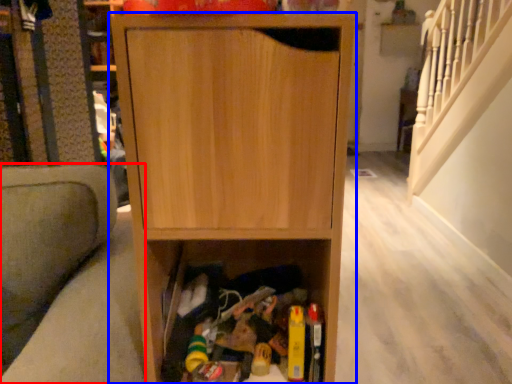
Question: Which object is closer to the camera taking this photo, armchair (highlighted by a red box) or cabinetry (highlighted by a blue box)?

Choices:
 (A) armchair
 (B) cabinetry

Answer: (A)